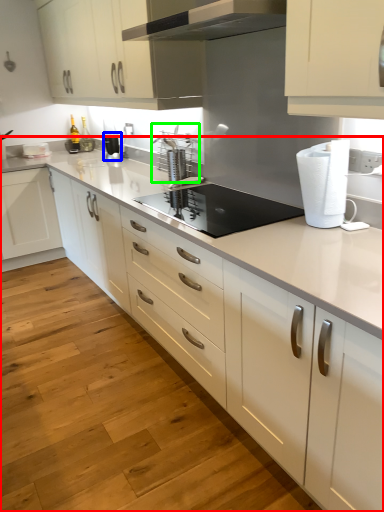
Question: Considering the real-world distances, which object is closest to countertop (highlighted by a red box)? kitchen appliance (highlighted by a blue box) or appliance (highlighted by a green box).

Choices:
 (A) kitchen appliance
 (B) appliance

Answer: (B)